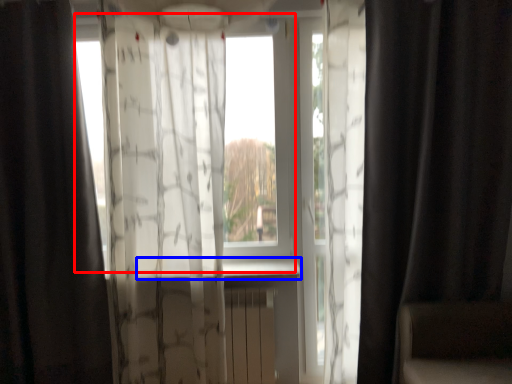
Question: Which point is closer to the camera, window screen (highlighted by a red box) or window sill (highlighted by a blue box)?

Choices:
 (A) window screen
 (B) window sill

Answer: (B)